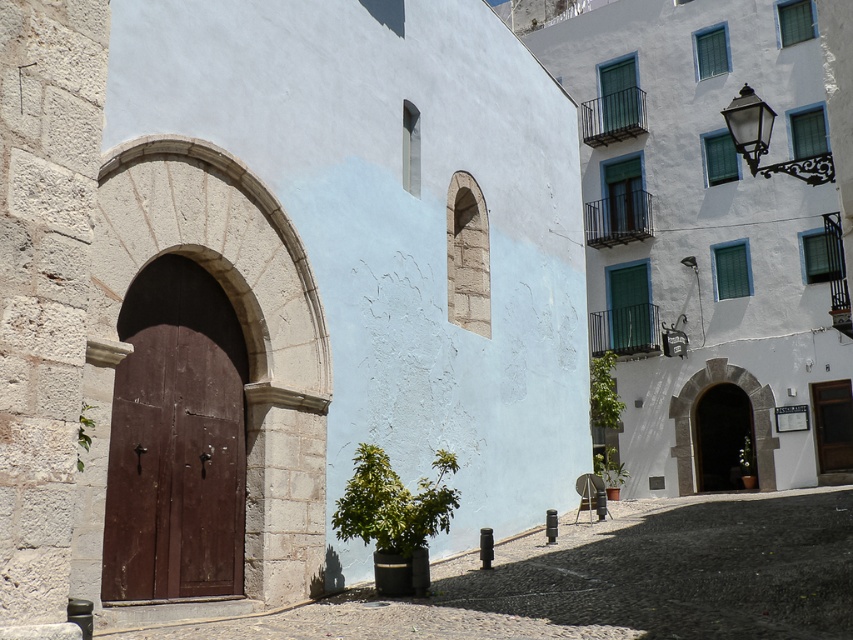
You are a tourist standing in front of the brown wooden door at center and want to walk into the smooth stone alley at center. In which direction should you move relative to the door?

To enter the smooth stone alley at center from the brown wooden door at center, you should move to the right since the smooth stone alley at center is located to the right of the door.

You are a delivery person trying to move a large wooden crate through the entrance. The crate is as wide as the brown wooden door at center. Will the crate fit through the entrance if you position it under the stone archway at center?

The stone archway at center is wider than the brown wooden door at center, so the crate, which is as wide as the door, should fit through the entrance when positioned under the archway.

You are a delivery person trying to enter the building through the brown wooden door at center. The stone archway at center is blocking your path. Can you walk around it to reach the door?

The stone archway at center is in front of the brown wooden door at center, so you can walk around it to reach the door since the archway is part of the building structure and the door is behind it.